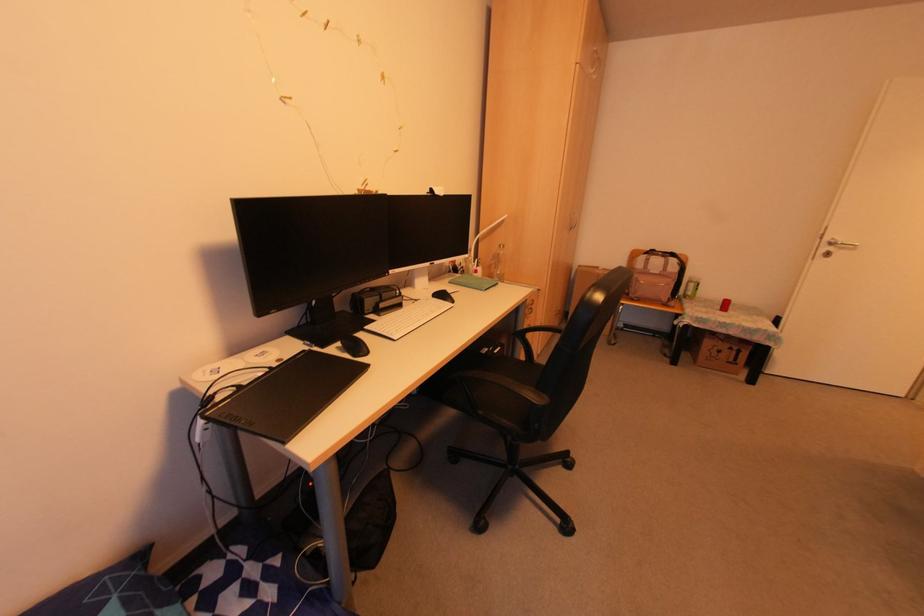
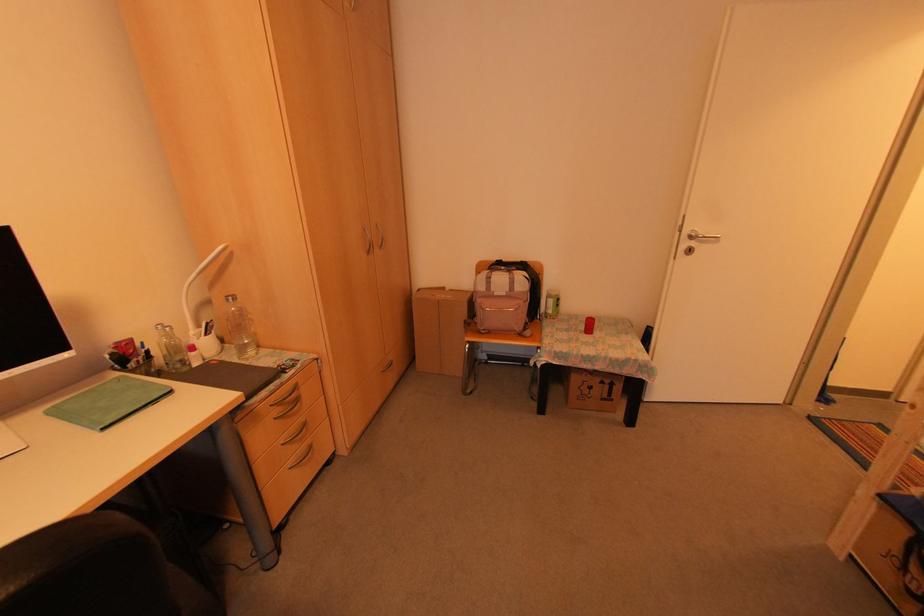
In the second image, find the point that corresponds to point 567,229 in the first image.

(366, 249)